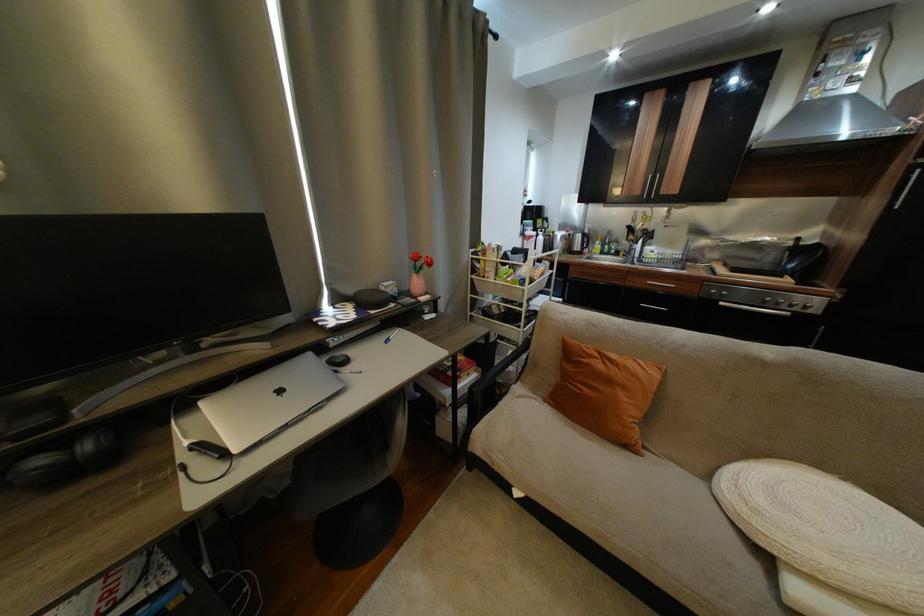
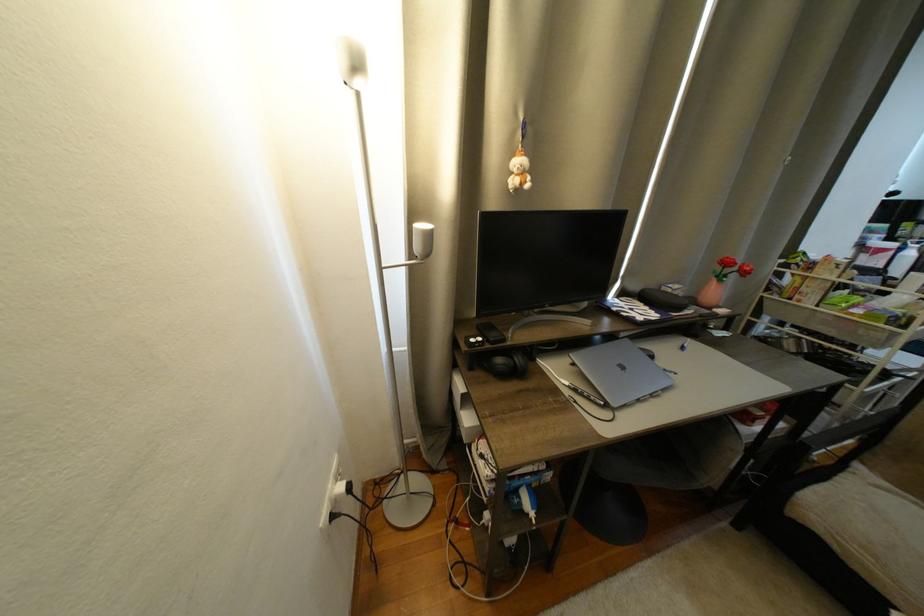
Find the pixel in the second image that matches (x=73, y=442) in the first image.

(517, 354)